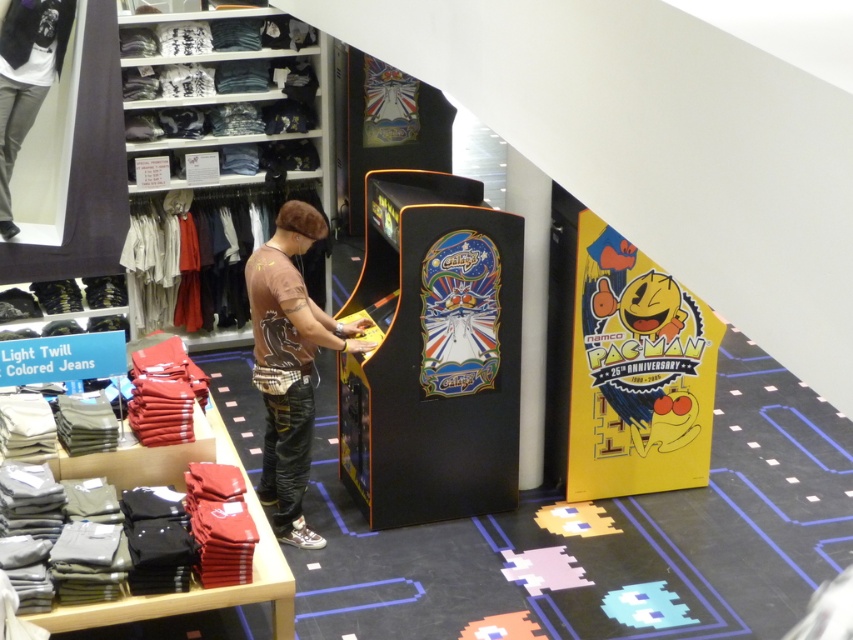
Between point (305, 236) and point (61, 51), which one is positioned behind?

The point (61, 51) is behind.

Which is above, brown cotton t-shirt at center or light gray jeans at center?

light gray jeans at center

Is point (265, 372) more distant than point (32, 80)?

No, (265, 372) is in front of (32, 80).

Locate an element on the screen. This screenshot has height=640, width=853. brown cotton t-shirt at center is located at coordinates (289, 364).

From the picture: Which is above, shiny black arcade machine at center or brown cotton t-shirt at center?

shiny black arcade machine at center is higher up.

Which is behind, point (442, 305) or point (282, 513)?

The point (282, 513) is more distant.

You are a GUI agent. You are given a task and a screenshot of the screen. Output one action in this format:
    pyautogui.click(x=<x>, y=<y>)
    Task: Click on the shiny black arcade machine at center
    Image resolution: width=853 pixels, height=640 pixels.
    Given the screenshot: What is the action you would take?
    pyautogui.click(x=433, y=353)

Locate an element on the screen. The image size is (853, 640). shiny black arcade machine at center is located at coordinates (433, 353).

Is shiny black arcade machine at center bigger than light gray jeans at center?

Indeed, shiny black arcade machine at center has a larger size compared to light gray jeans at center.

How much distance is there between shiny black arcade machine at center and light gray jeans at center?

shiny black arcade machine at center and light gray jeans at center are 10.74 feet apart.

Between point (440, 291) and point (33, 90), which one is positioned in front?

Point (440, 291)

Locate an element on the screen. The image size is (853, 640). shiny black arcade machine at center is located at coordinates (433, 353).